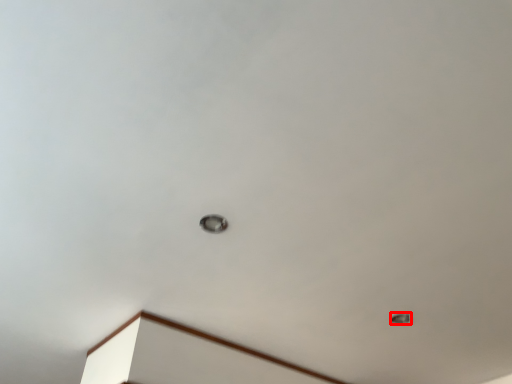
Question: From the image, what is the correct spatial relationship of lamp (annotated by the red box) in relation to lamp?

Choices:
 (A) right
 (B) left

Answer: (A)